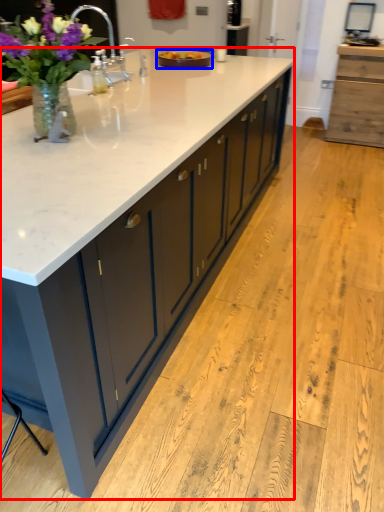
Question: Which object is further to the camera taking this photo, countertop (highlighted by a red box) or tray (highlighted by a blue box)?

Choices:
 (A) countertop
 (B) tray

Answer: (B)